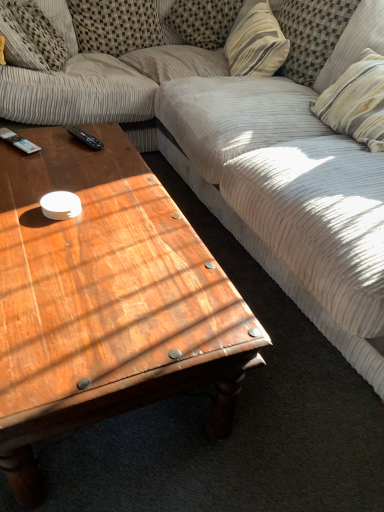
Locate an element on the screen. The image size is (384, 512). free space above wooden coffee table at center (from a real-world perspective) is located at coordinates (85, 215).